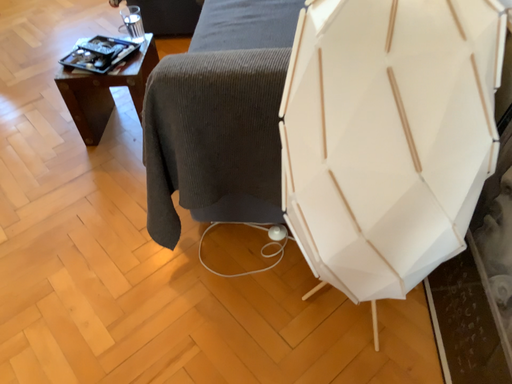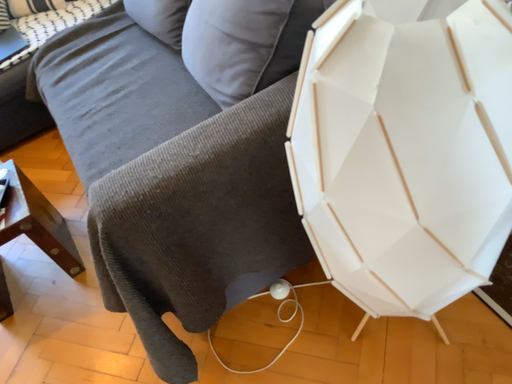
Question: How did the camera likely rotate when shooting the video?

Choices:
 (A) rotated upward
 (B) rotated downward

Answer: (A)